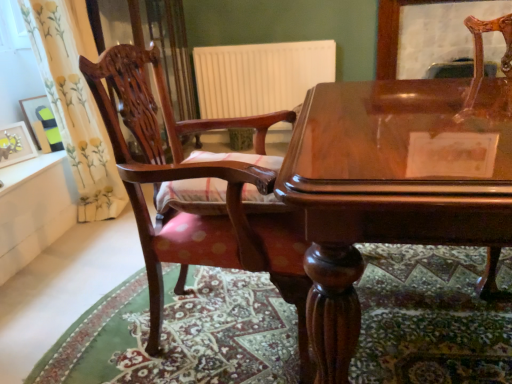
Find the location of a particular element. free space above white matte radiator at center (from a real-world perspective) is located at coordinates (257, 42).